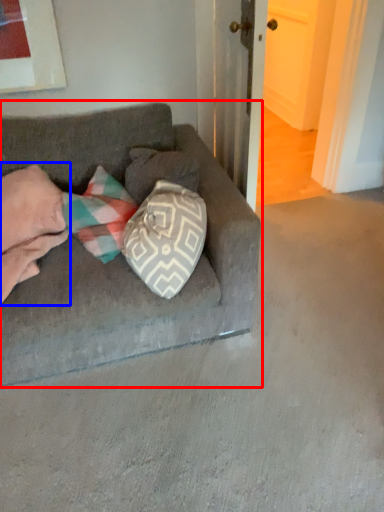
Question: Among these objects, which one is nearest to the camera, studio couch (highlighted by a red box) or couple (highlighted by a blue box)?

Choices:
 (A) studio couch
 (B) couple

Answer: (A)